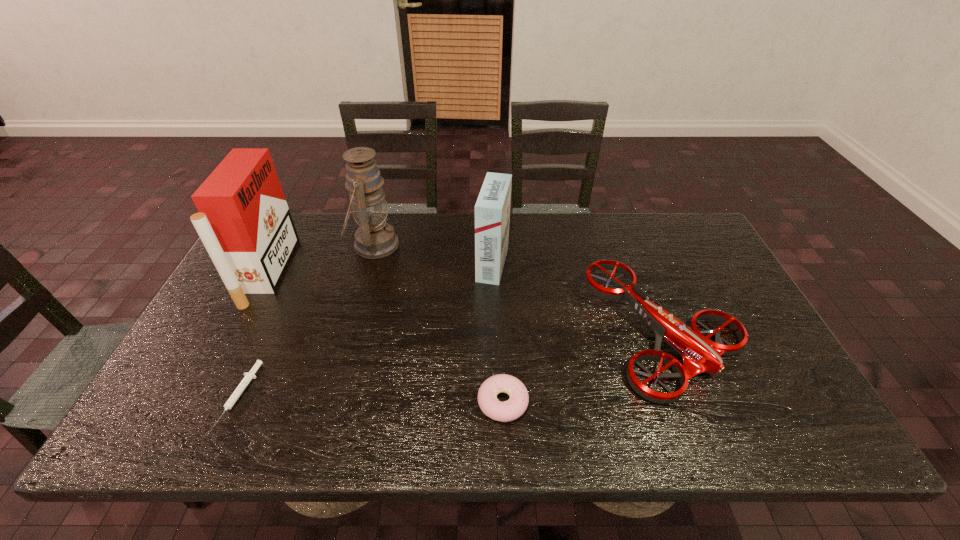
Locate an element on the screen. vacant region located 0.070m on the right of the oil lamp is located at coordinates (420, 245).

Locate an element on the screen. free space located on the front-facing side of the leftmost object is located at coordinates (378, 272).

Locate an element on the screen. vacant position located 0.190m on the left of the shorter cigarette case is located at coordinates (414, 264).

At what (x,y) coordinates should I click in order to perform the action: click on free region located 0.180m on the left of the fourth tallest object. Please return your answer as a coordinate pair (x, y). Looking at the image, I should click on click(x=523, y=333).

Where is `free space located 0.320m on the back of the doughnut`? free space located 0.320m on the back of the doughnut is located at coordinates (498, 286).

You are a GUI agent. You are given a task and a screenshot of the screen. Output one action in this format:
    pyautogui.click(x=<x>, y=<y>)
    Task: Click on the vacant space situated 0.240m on the back of the shortest object
    This screenshot has width=960, height=540.
    Given the screenshot: What is the action you would take?
    pyautogui.click(x=286, y=294)

The height and width of the screenshot is (540, 960). Identify the location of oil lamp present at the far edge. (375, 238).

This screenshot has width=960, height=540. What are the coordinates of `doughnut located in the near edge section of the desktop` in the screenshot? It's located at (509, 410).

I want to click on syringe at the near edge, so click(236, 394).

This screenshot has width=960, height=540. Find the location of `cigarette case that is positioned at the left edge`. cigarette case that is positioned at the left edge is located at coordinates (244, 222).